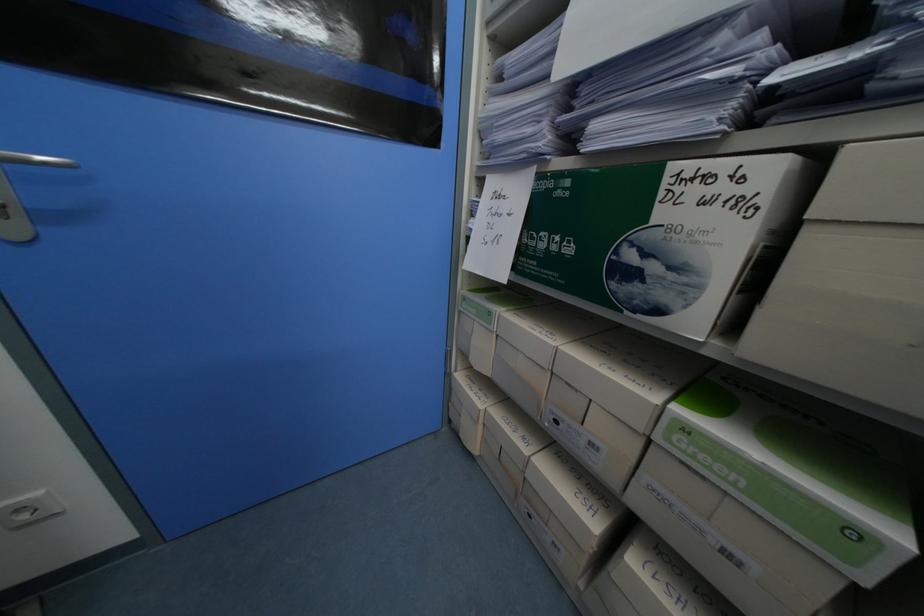
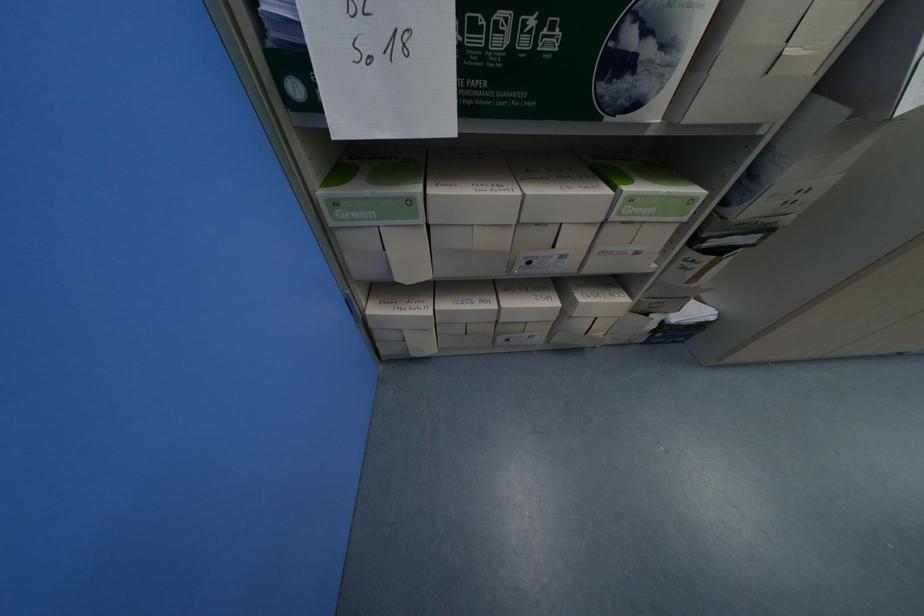
In the second image, find the point that corresponds to the point at 467,378 in the first image.

(381, 312)